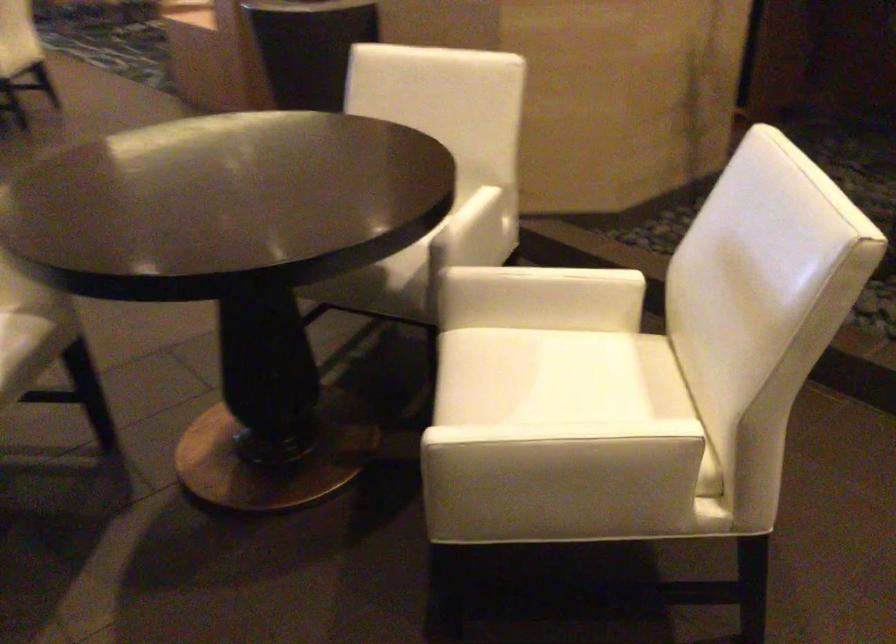
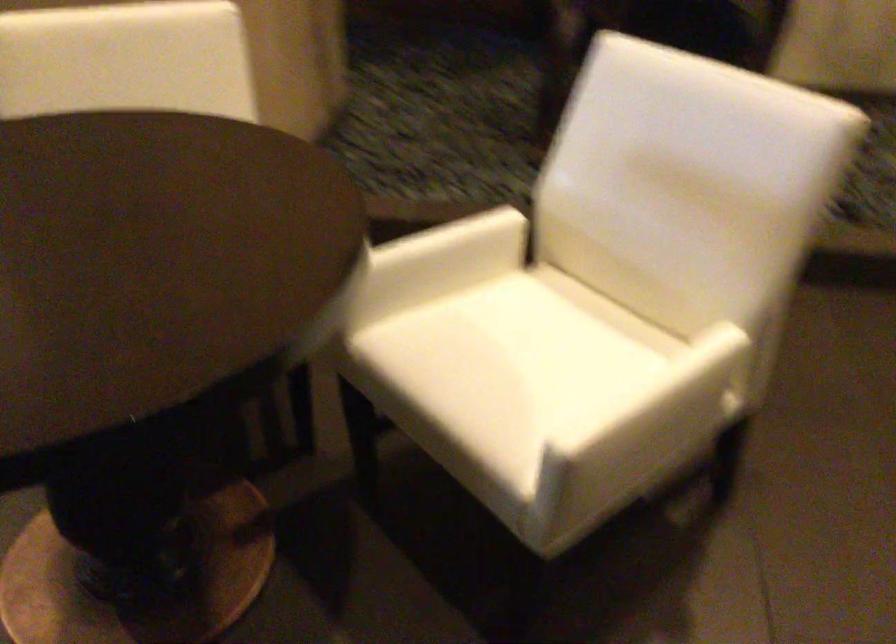
Question: How did the camera likely rotate?

Choices:
 (A) Left
 (B) Right
 (C) Up
 (D) Down

Answer: (B)